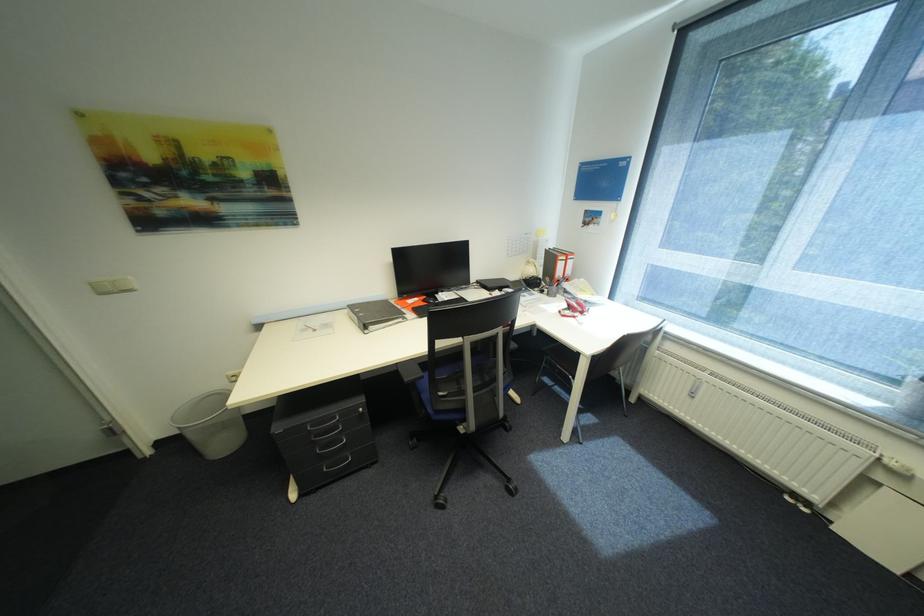
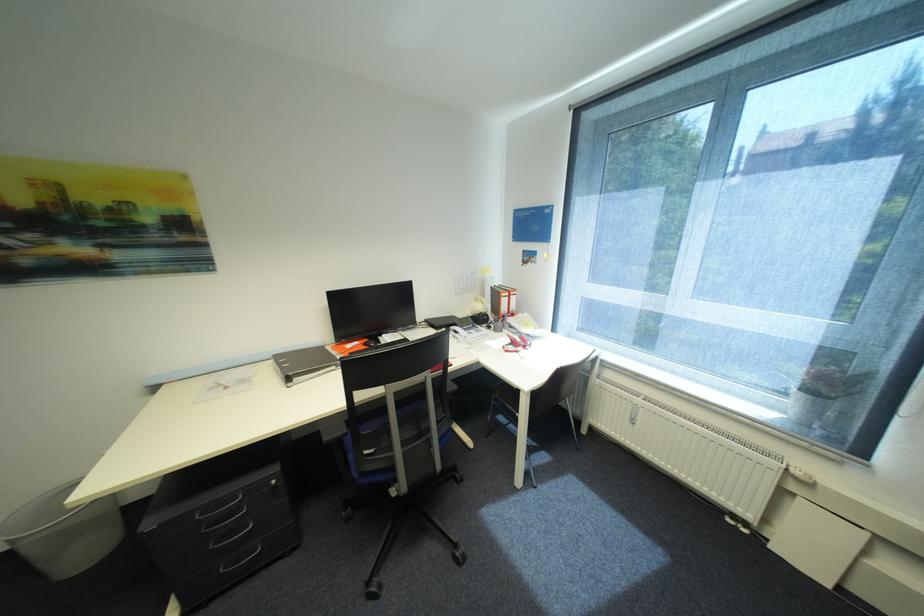
The point at (x=185, y=434) is marked in the first image. Where is the corresponding point in the second image?

(14, 548)